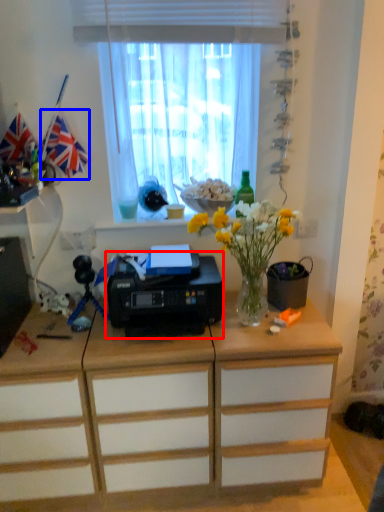
Question: Among these objects, which one is nearest to the camera, printer (highlighted by a red box) or flag (highlighted by a blue box)?

Choices:
 (A) printer
 (B) flag

Answer: (A)